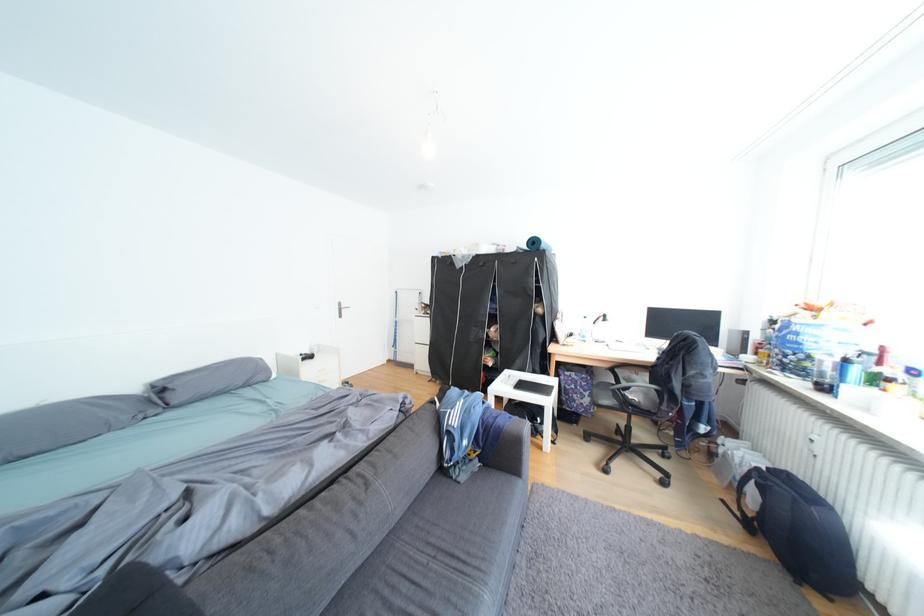
Image resolution: width=924 pixels, height=616 pixels. Identify the location of silver door handle. (341, 309).